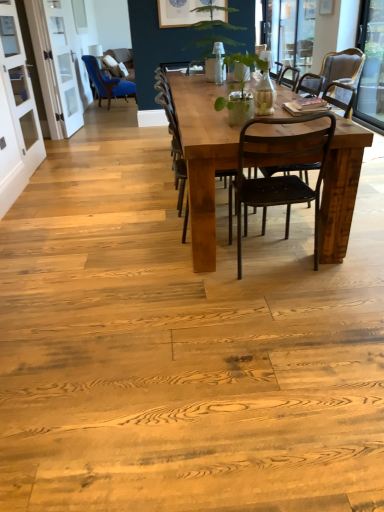
Question: Is white glass screen door at upper left, arranged as the 2th screen door when viewed from the front, bigger than transparent glass window at upper right, the second window screen viewed from the front?

Choices:
 (A) no
 (B) yes

Answer: (A)

Question: Is white glass screen door at upper left, positioned as the 1th screen door in back-to-front order, positioned with its back to transparent glass window at upper right, which ranks as the first window screen in back-to-front order?

Choices:
 (A) no
 (B) yes

Answer: (A)

Question: From a real-world perspective, is white glass screen door at upper left, arranged as the 2th screen door when viewed from the front, under transparent glass window at upper right, which is the 1th window screen in left-to-right order?

Choices:
 (A) no
 (B) yes

Answer: (B)

Question: Considering the relative positions of white glass screen door at upper left, positioned as the 1th screen door in back-to-front order, and transparent glass window at upper right, the second window screen viewed from the front, in the image provided, is white glass screen door at upper left, positioned as the 1th screen door in back-to-front order, to the left of transparent glass window at upper right, the second window screen viewed from the front, from the viewer's perspective?

Choices:
 (A) yes
 (B) no

Answer: (A)

Question: From the image's perspective, does white glass screen door at upper left, positioned as the 1th screen door in back-to-front order, appear higher than transparent glass window at upper right, which appears as the 2th window screen when ordered from the bottom?

Choices:
 (A) no
 (B) yes

Answer: (A)

Question: Is transparent glass window at upper right, placed as the 1th window screen when sorted from top to bottom, taller or shorter than matte black chair at right, which appears as the second chair when viewed from the back?

Choices:
 (A) tall
 (B) short

Answer: (A)

Question: From the image's perspective, is transparent glass window at upper right, which ranks as the first window screen in back-to-front order, located above or below matte black chair at right, the 1th chair when ordered from right to left?

Choices:
 (A) above
 (B) below

Answer: (A)

Question: Is transparent glass window at upper right, the second window screen in the right-to-left sequence, bigger or smaller than matte black chair at right, which is the 5th chair in left-to-right order?

Choices:
 (A) big
 (B) small

Answer: (B)

Question: Looking at their shapes, would you say transparent glass window at upper right, which appears as the 2th window screen when ordered from the bottom, is wider or thinner than matte black chair at right, which is the 5th chair in left-to-right order?

Choices:
 (A) wide
 (B) thin

Answer: (B)

Question: In the image, is blue velvet chair at left, acting as the first chair starting from the back, on the left side or the right side of rustic wood chair at center, placed as the second chair when sorted from left to right?

Choices:
 (A) right
 (B) left

Answer: (B)

Question: Is blue velvet chair at left, acting as the first chair starting from the back, taller or shorter than rustic wood chair at center, the fourth chair viewed from the right?

Choices:
 (A) tall
 (B) short

Answer: (B)

Question: Looking at their shapes, would you say blue velvet chair at left, acting as the first chair starting from the back, is wider or thinner than rustic wood chair at center, the fourth chair viewed from the right?

Choices:
 (A) wide
 (B) thin

Answer: (A)

Question: Looking at the image, does blue velvet chair at left, the 1th chair when ordered from left to right, seem bigger or smaller compared to rustic wood chair at center, which is the second chair in front-to-back order?

Choices:
 (A) small
 (B) big

Answer: (B)

Question: Would you say matte black chair at center, placed as the 4th chair when sorted from left to right, is inside or outside rustic wood chair at center, which is the second chair in front-to-back order?

Choices:
 (A) outside
 (B) inside

Answer: (A)

Question: Considering the relative positions of matte black chair at center, the second chair when ordered from right to left, and rustic wood chair at center, the fourth chair viewed from the right, in the image provided, is matte black chair at center, the second chair when ordered from right to left, to the left or to the right of rustic wood chair at center, the fourth chair viewed from the right,?

Choices:
 (A) right
 (B) left

Answer: (A)